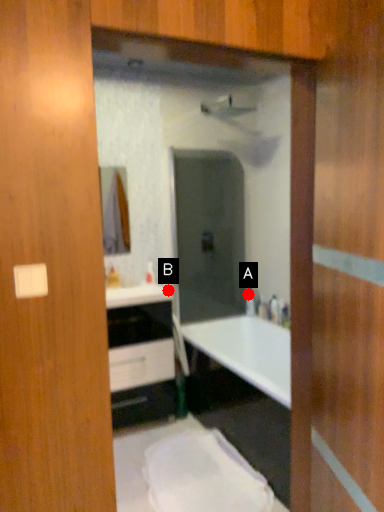
Question: Two points are circled on the image, labeled by A and B beside each circle. Among these points, which one is farthest from the camera?

Choices:
 (A) A is further
 (B) B is further

Answer: (A)